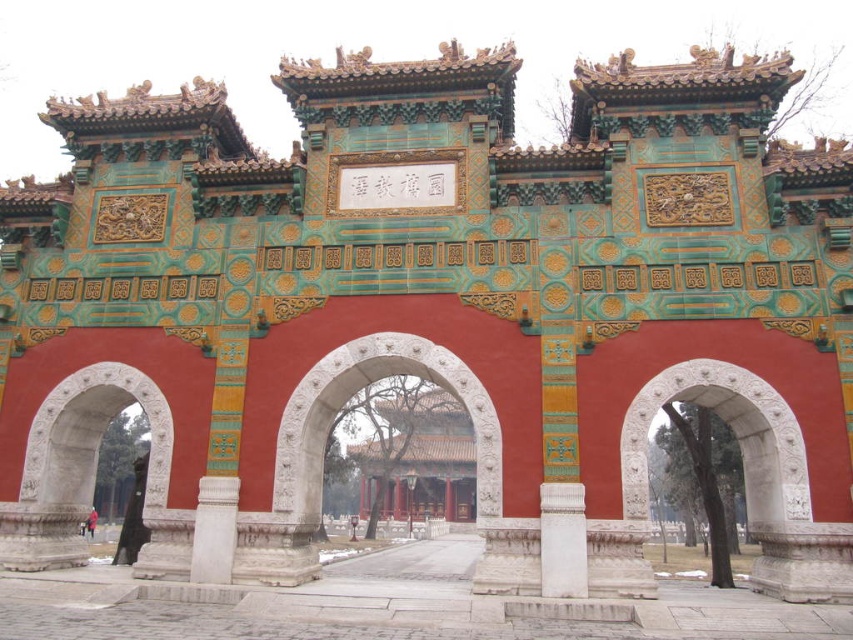
Question: Is white stone archway at right further to camera compared to white marble pillar at center?

Choices:
 (A) yes
 (B) no

Answer: (B)

Question: Can you confirm if white stone archway at left is positioned to the left of red cloth coat at center?

Choices:
 (A) yes
 (B) no

Answer: (B)

Question: Which object is closer to the camera taking this photo?

Choices:
 (A) white marble pillar at center
 (B) white stone archway at left
 (C) red cloth coat at center
 (D) white stone archway at right

Answer: (D)

Question: In this image, where is white stone archway at left located relative to white stone archway at center?

Choices:
 (A) below
 (B) above

Answer: (A)

Question: Which object is closer to the camera taking this photo?

Choices:
 (A) white stone archway at left
 (B) white marble pillar at center

Answer: (B)

Question: Which point is farther to the camera?

Choices:
 (A) white stone archway at center
 (B) white stone archway at right

Answer: (A)